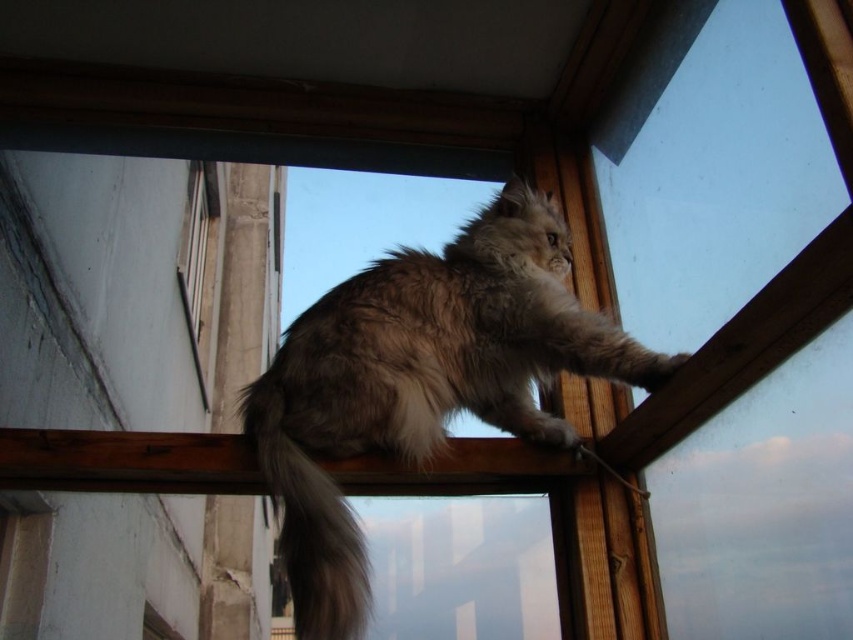
Question: Can you confirm if fuzzy fur tail at upper center is positioned below transparent plastic window at center?

Choices:
 (A) yes
 (B) no

Answer: (A)

Question: Does fuzzy fur cat at upper center have a smaller size compared to transparent plastic window at center?

Choices:
 (A) yes
 (B) no

Answer: (B)

Question: Estimate the real-world distances between objects in this image. Which object is farther from the transparent plastic window at center?

Choices:
 (A) fuzzy fur cat at upper center
 (B) fuzzy fur tail at upper center

Answer: (A)

Question: Observing the image, what is the correct spatial positioning of fuzzy fur cat at upper center in reference to fuzzy fur tail at upper center?

Choices:
 (A) right
 (B) left

Answer: (A)

Question: Considering the real-world distances, which object is closest to the fuzzy fur cat at upper center?

Choices:
 (A) transparent plastic window at center
 (B) fuzzy fur tail at upper center

Answer: (B)

Question: Among these points, which one is nearest to the camera?

Choices:
 (A) (283, 436)
 (B) (569, 349)

Answer: (A)